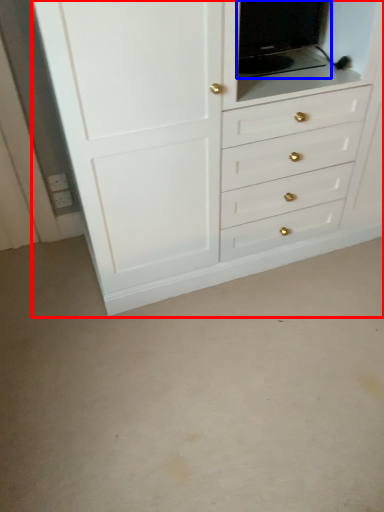
Question: Among these objects, which one is farthest to the camera, chest of drawers (highlighted by a red box) or medicine cabinet (highlighted by a blue box)?

Choices:
 (A) chest of drawers
 (B) medicine cabinet

Answer: (B)